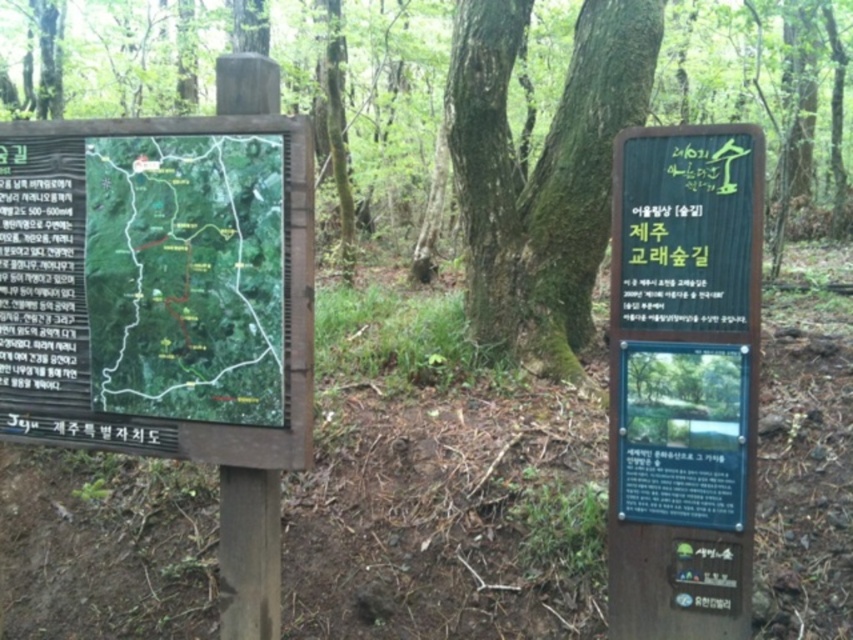
Does green wooden sign at center appear on the right side of green mossy tree at center?

Correct, you'll find green wooden sign at center to the right of green mossy tree at center.

Between point (730, 451) and point (524, 188), which one is positioned behind?

The point (524, 188) is behind.

The width and height of the screenshot is (853, 640). In order to click on green wooden sign at center in this screenshot , I will do `click(683, 380)`.

Which is above, green matte map at center-left or green mossy tree at center?

green mossy tree at center is above.

Which of these two, green matte map at center-left or green mossy tree at center, stands shorter?

green matte map at center-left is shorter.

Where is `green matte map at center-left`? The height and width of the screenshot is (640, 853). green matte map at center-left is located at coordinates (186, 275).

Who is more forward, (663, 228) or (155, 394)?

Point (663, 228)

The height and width of the screenshot is (640, 853). In order to click on green wooden sign at center in this screenshot , I will do tap(683, 380).